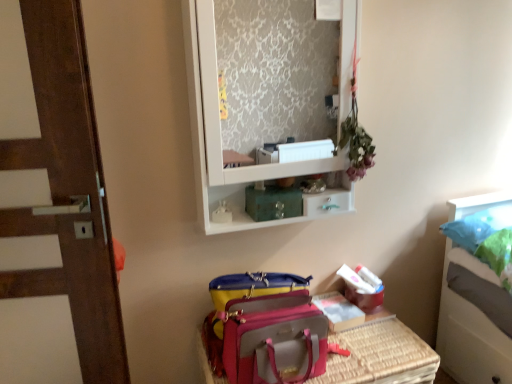
Question: Do you think metallic teal drawer at upper center is within white glossy medicine cabinet at upper center, or outside of it?

Choices:
 (A) outside
 (B) inside

Answer: (B)

Question: In terms of height, does metallic teal drawer at upper center look taller or shorter compared to white glossy medicine cabinet at upper center?

Choices:
 (A) short
 (B) tall

Answer: (A)

Question: Estimate the real-world distances between objects in this image. Which object is farther from the pink fabric suitcase at lower center?

Choices:
 (A) metallic teal drawer at upper center
 (B) white glossy medicine cabinet at upper center

Answer: (B)

Question: Which is nearer to the metallic teal drawer at upper center?

Choices:
 (A) pink fabric suitcase at lower center
 (B) white glossy medicine cabinet at upper center

Answer: (A)